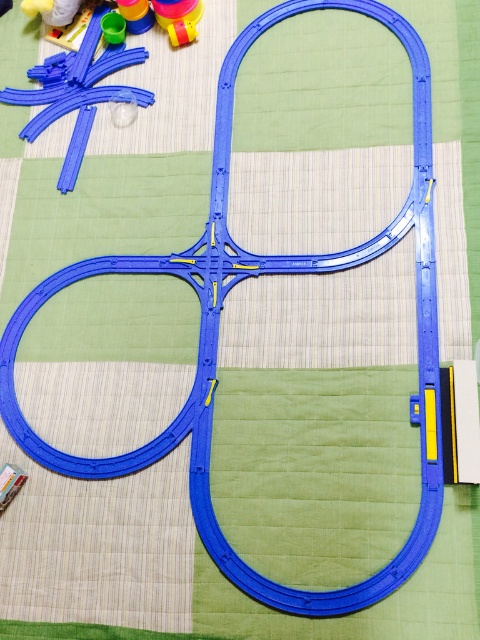
Question: Is rubber yellow toy at upper center to the left of translucent yellow cup at upper left from the viewer's perspective?

Choices:
 (A) yes
 (B) no

Answer: (B)

Question: Is the position of matte plastic track at upper left more distant than that of rubberized yellow cup at upper left?

Choices:
 (A) no
 (B) yes

Answer: (A)

Question: Is rubber yellow toy at upper center positioned before translucent yellow cup at upper left?

Choices:
 (A) yes
 (B) no

Answer: (A)

Question: Which of these objects is positioned closest to the rubberized yellow cup at upper left?

Choices:
 (A) matte plastic track at upper left
 (B) translucent yellow cup at upper left
 (C) rubber yellow toy at upper center

Answer: (B)

Question: Which point is farther to the camera?

Choices:
 (A) rubberized yellow cup at upper left
 (B) rubber yellow toy at upper center

Answer: (A)

Question: Based on their relative distances, which object is nearer to the rubber yellow toy at upper center?

Choices:
 (A) matte plastic track at upper left
 (B) translucent yellow cup at upper left

Answer: (B)